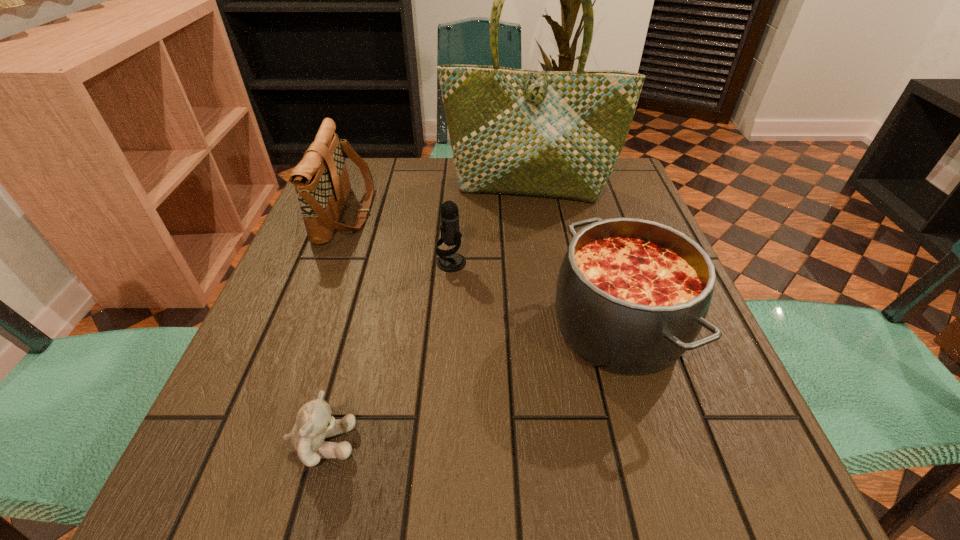
What are the coordinates of `object that is at the far right corner` in the screenshot? It's located at (559, 134).

Where is `free region at the far edge of the desktop`? Image resolution: width=960 pixels, height=540 pixels. free region at the far edge of the desktop is located at coordinates click(x=434, y=160).

In the image, there is a desktop. Find the location of `free space at the near edge`. free space at the near edge is located at coordinates (417, 511).

The width and height of the screenshot is (960, 540). What are the coordinates of `vacant region at the left edge of the desktop` in the screenshot? It's located at (325, 367).

Where is `vacant space at the right edge of the desktop`? Image resolution: width=960 pixels, height=540 pixels. vacant space at the right edge of the desktop is located at coordinates (639, 392).

You are a GUI agent. You are given a task and a screenshot of the screen. Output one action in this format:
    pyautogui.click(x=<x>, y=<y>)
    Task: Click on the free space at the far left corner of the desktop
    
    Given the screenshot: What is the action you would take?
    point(390,169)

Find the location of a particular element. free space at the far right corner of the desktop is located at coordinates (610, 203).

The width and height of the screenshot is (960, 540). What are the coordinates of `vacant space that's between the shoulder bag and the casserole` in the screenshot? It's located at (482, 271).

Where is `empty location between the shopping bag and the nearest object`? This screenshot has height=540, width=960. empty location between the shopping bag and the nearest object is located at coordinates (425, 315).

Image resolution: width=960 pixels, height=540 pixels. What are the coordinates of `vacant space in between the microphone and the shopping bag` in the screenshot? It's located at (490, 226).